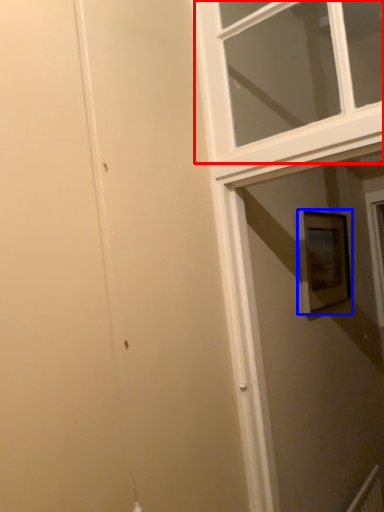
Question: Which of the following is the farthest to the observer, window (highlighted by a red box) or picture frame (highlighted by a blue box)?

Choices:
 (A) window
 (B) picture frame

Answer: (B)